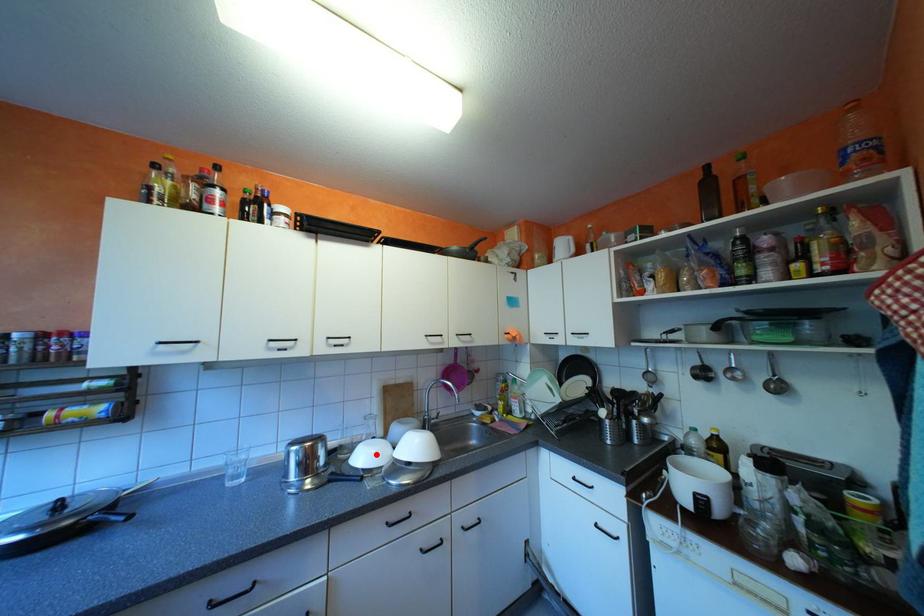
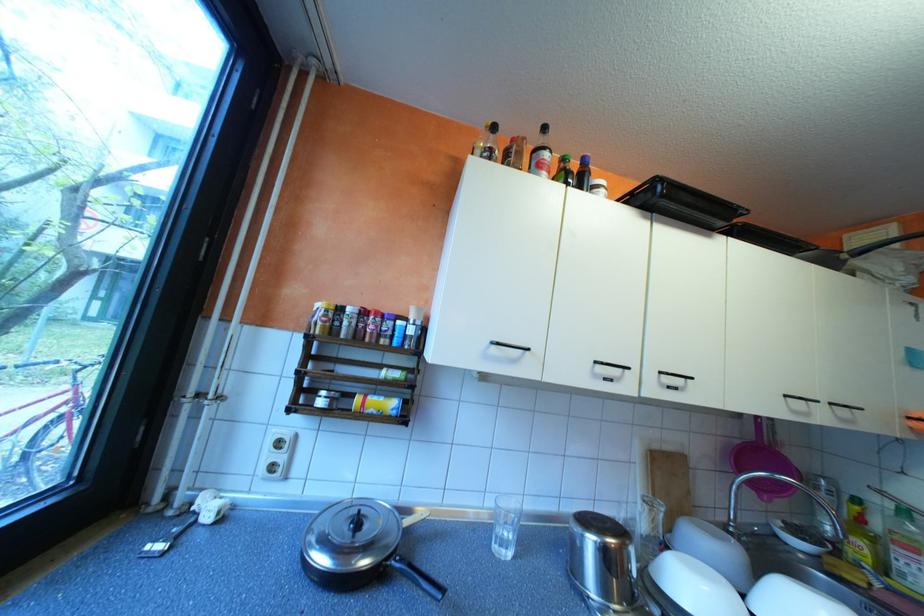
Locate, in the second image, the point that corresponds to the highlighted location in the first image.

(709, 592)